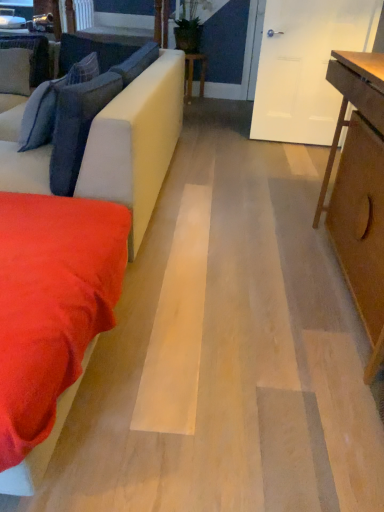
Identify the location of free region on the left part of light brown wooden table at right, which is the 1th table from right to left. (230, 278).